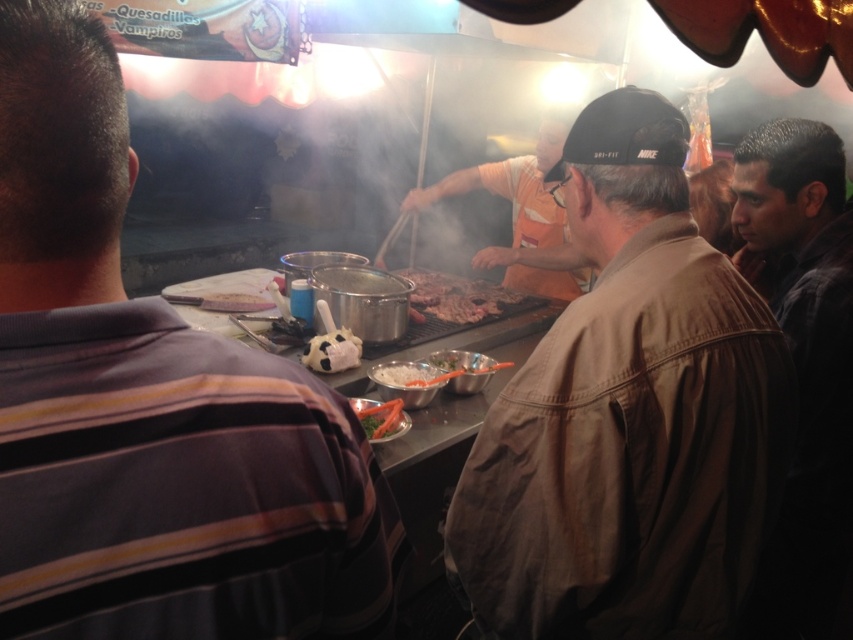
You are a customer at the food stall and you want to buy a jacket. You see the brown cotton jacket at center and the dark brown leather jacket at right. Which jacket is placed higher than the other?

The brown cotton jacket at center is placed higher than the dark brown leather jacket at right because it is positioned over it.

You are a food stall worker who needs to hand a menu to the person in the striped cotton shirt at left and the person in the brown cotton jacket at center. Which person should you approach first to reach them without crossing paths?

You should approach the striped cotton shirt at left first because it is positioned to the left of the brown cotton jacket at center, so you can reach them without crossing paths by moving towards the left side first.

You are a food vendor at the stall and want to place a new menu board between the dark brown leather jacket at right and the grilled meat at center. Since the menu board is 1.2 meters wide, can you fit it there?

The dark brown leather jacket at right is narrower than the grilled meat at center. However, without knowing the exact width of either object, it is impossible to determine if the 1.2 meter menu board will fit between them.